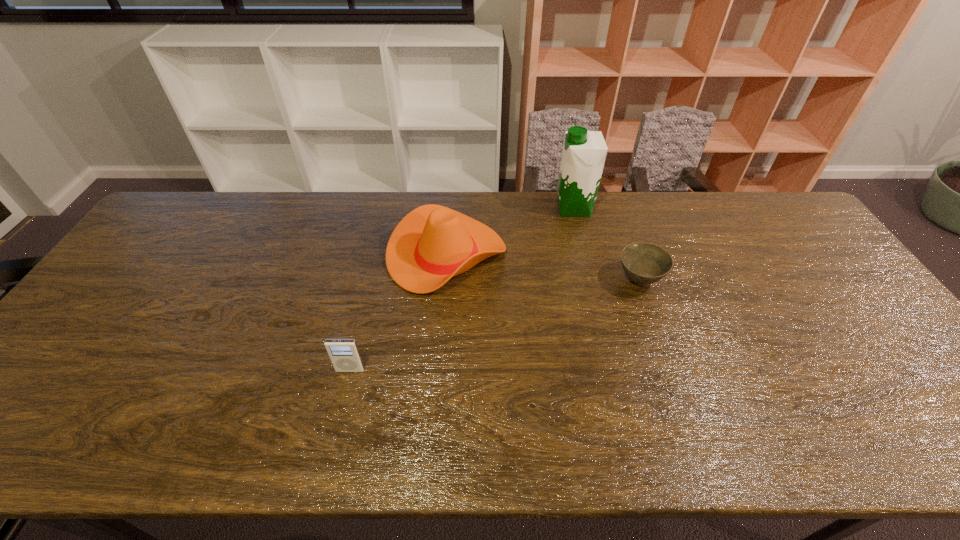
Where is `free space located on the left of the third shortest object`? This screenshot has width=960, height=540. free space located on the left of the third shortest object is located at coordinates 361,255.

You are a GUI agent. You are given a task and a screenshot of the screen. Output one action in this format:
    pyautogui.click(x=<x>, y=<y>)
    Task: Click on the vacant space positioned 0.100m on the front-facing side of the iPod
    This screenshot has width=960, height=540.
    Given the screenshot: What is the action you would take?
    pyautogui.click(x=340, y=411)

This screenshot has height=540, width=960. What are the coordinates of `free space located 0.130m on the front of the rightmost object` in the screenshot? It's located at (659, 336).

Where is `soya milk located in the far edge section of the desktop`? soya milk located in the far edge section of the desktop is located at coordinates (584, 152).

In order to click on cowboy hat situated at the far edge in this screenshot , I will do `click(431, 244)`.

The height and width of the screenshot is (540, 960). Identify the location of vacant space at the far edge of the desktop. (502, 233).

What are the coordinates of `free space at the near edge` in the screenshot? It's located at (490, 435).

This screenshot has width=960, height=540. Find the location of `free region at the left edge of the desktop`. free region at the left edge of the desktop is located at coordinates (156, 259).

Locate an element on the screen. The image size is (960, 540). free space at the far left corner of the desktop is located at coordinates (206, 208).

Locate an element on the screen. This screenshot has height=540, width=960. free space between the tallest object and the bowl is located at coordinates (607, 244).